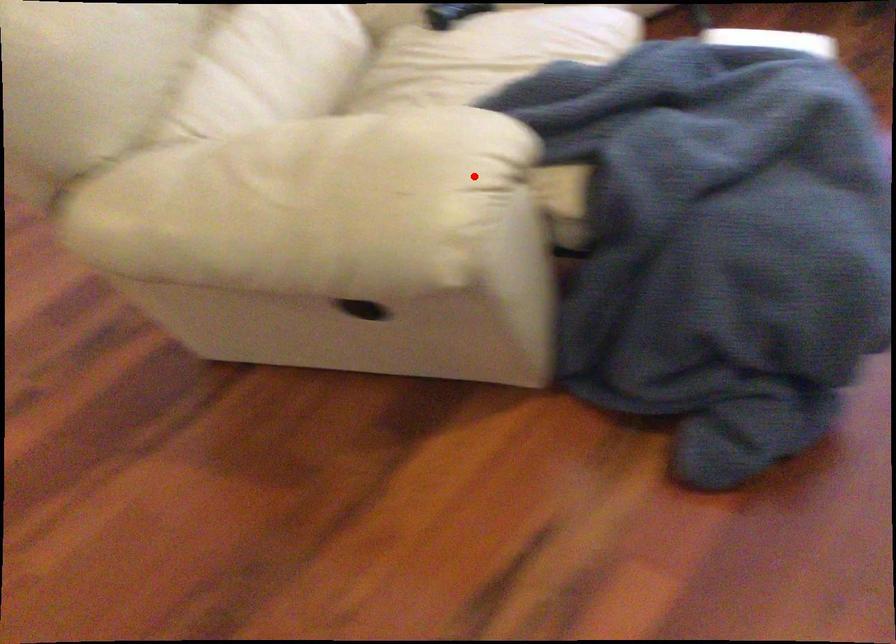
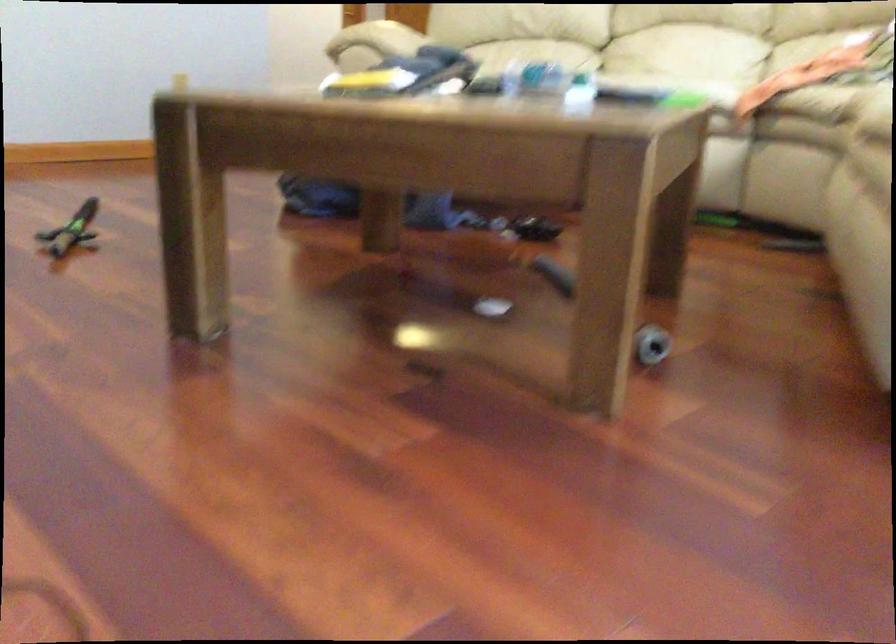
Locate, in the second image, the point that corresponds to the highlighted location in the first image.

(371, 44)